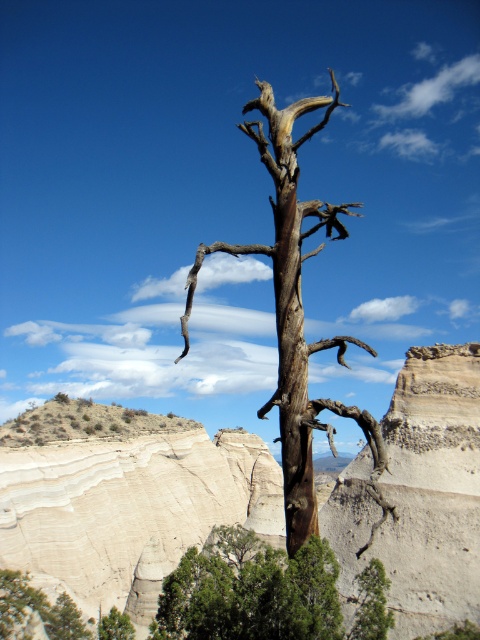
Question: Is brown rough bark tree at center above green leafy tree at lower center?

Choices:
 (A) yes
 (B) no

Answer: (A)

Question: Can you confirm if smooth sandstone cliff at center is positioned below green leafy tree at lower center?

Choices:
 (A) no
 (B) yes

Answer: (A)

Question: Which object is closer to the camera taking this photo?

Choices:
 (A) green matte tree at lower left
 (B) green leafy tree at lower center
 (C) brown rough bark tree at center
 (D) green matte tree at lower right

Answer: (C)

Question: Which of the following is the closest to the observer?

Choices:
 (A) (432, 488)
 (B) (350, 417)

Answer: (B)

Question: Is smooth sandstone cliff at center positioned in front of green matte tree at lower right?

Choices:
 (A) no
 (B) yes

Answer: (B)

Question: Which object is positioned closest to the smooth sandstone cliff at center?

Choices:
 (A) green leafy tree at lower center
 (B) green matte tree at lower right
 (C) brown rough bark tree at center
 (D) green matte tree at lower left

Answer: (B)